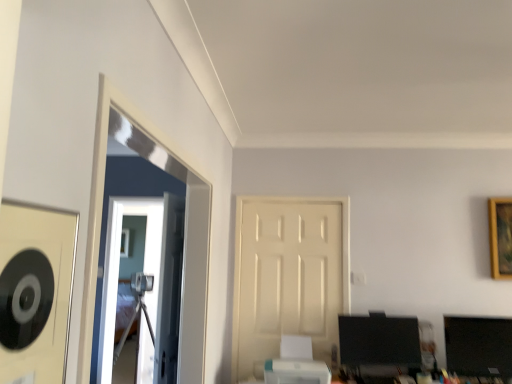
Question: From the image's perspective, is white matte door at center under transparent glass door at center?

Choices:
 (A) yes
 (B) no

Answer: (B)

Question: From a real-world perspective, does white matte door at center stand above transparent glass door at center?

Choices:
 (A) no
 (B) yes

Answer: (B)

Question: Is white matte door at center surrounding transparent glass door at center?

Choices:
 (A) no
 (B) yes

Answer: (A)

Question: Considering the relative sizes of white matte door at center and transparent glass door at center in the image provided, is white matte door at center wider than transparent glass door at center?

Choices:
 (A) no
 (B) yes

Answer: (B)

Question: Considering the relative sizes of white matte door at center and transparent glass door at center in the image provided, is white matte door at center smaller than transparent glass door at center?

Choices:
 (A) no
 (B) yes

Answer: (A)

Question: Is point (259, 276) positioned closer to the camera than point (291, 352)?

Choices:
 (A) closer
 (B) farther

Answer: (B)

Question: Considering their positions, is white matte door at center located in front of or behind white plastic printer at lower center?

Choices:
 (A) front
 (B) behind

Answer: (B)

Question: Considering the positions of white matte door at center and white plastic printer at lower center in the image, is white matte door at center taller or shorter than white plastic printer at lower center?

Choices:
 (A) short
 (B) tall

Answer: (B)

Question: Considering the positions of white matte door at center and white plastic printer at lower center in the image, is white matte door at center bigger or smaller than white plastic printer at lower center?

Choices:
 (A) big
 (B) small

Answer: (B)

Question: From the image's perspective, is gold wooden picture frame at upper right located above or below transparent glass door at center?

Choices:
 (A) below
 (B) above

Answer: (B)

Question: Considering the positions of gold wooden picture frame at upper right and transparent glass door at center in the image, is gold wooden picture frame at upper right bigger or smaller than transparent glass door at center?

Choices:
 (A) small
 (B) big

Answer: (A)

Question: From their relative heights in the image, would you say gold wooden picture frame at upper right is taller or shorter than transparent glass door at center?

Choices:
 (A) short
 (B) tall

Answer: (A)

Question: Relative to transparent glass door at center, is gold wooden picture frame at upper right in front or behind?

Choices:
 (A) behind
 (B) front

Answer: (B)

Question: Is white matte door at center situated inside matte black monitor at lower right or outside?

Choices:
 (A) outside
 (B) inside

Answer: (A)

Question: Considering the positions of white matte door at center and matte black monitor at lower right in the image, is white matte door at center taller or shorter than matte black monitor at lower right?

Choices:
 (A) short
 (B) tall

Answer: (B)